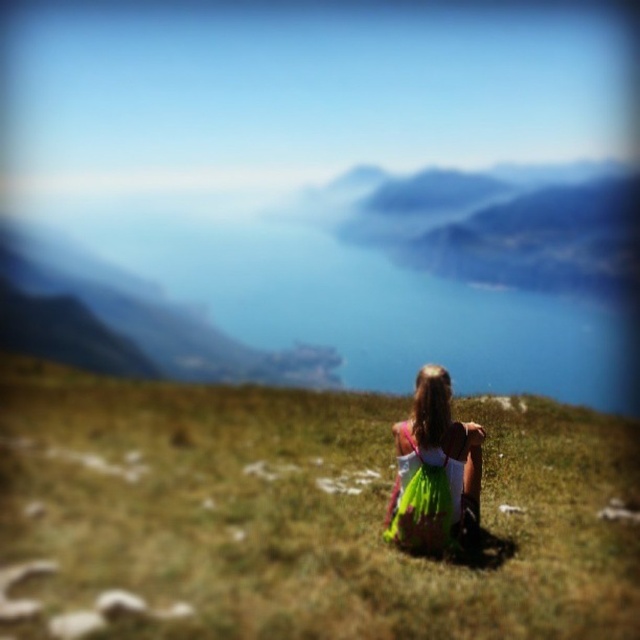
Is green grassy at center closer to camera compared to green satin dress at center?

Yes, it is.

Does green grassy at center have a lesser width compared to green satin dress at center?

In fact, green grassy at center might be wider than green satin dress at center.

Who is more forward, (532, 433) or (408, 515)?

Point (408, 515) is more forward.

Where is `green grassy at center`? green grassy at center is located at coordinates (298, 515).